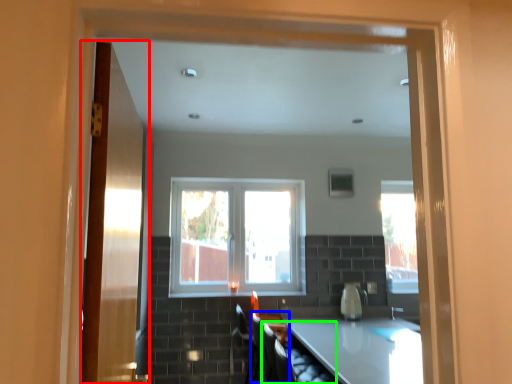
Question: Based on their relative distances, which object is farther from door (highlighted by a red box)? Choose from armchair (highlighted by a blue box) and armchair (highlighted by a green box).

Choices:
 (A) armchair
 (B) armchair

Answer: (A)